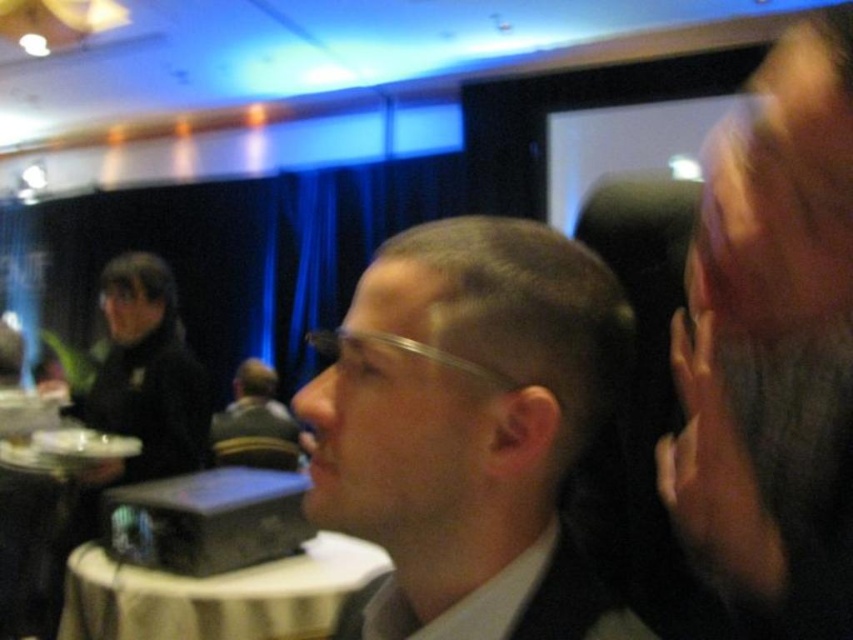
You are standing at the point labeled point (535, 618) and want to take a photo of the man in the suit using a camera that has a maximum focus range of 20 inches. Can the camera focus on him from your current position?

The distance between point (535, 618) and the camera is 18.67 inches, which is within the camera maximum focus range of 20 inches. Therefore, the camera can focus on the man in the suit from your current position.

You are standing in the room where the image was taken. There is a point at coordinates point (572, 404). Can you reach this point without moving your body?

The point (572, 404) is 19.02 inches away from you, so you can reach it without moving your body if your arm can extend that far.

You are standing in the room and want to walk towards the point closer to the camera between the two points, point (387, 442) and point (154, 630). Which point should you walk towards?

You should walk towards point (387, 442) because it is in front of point (154, 630), making it closer to the camera.